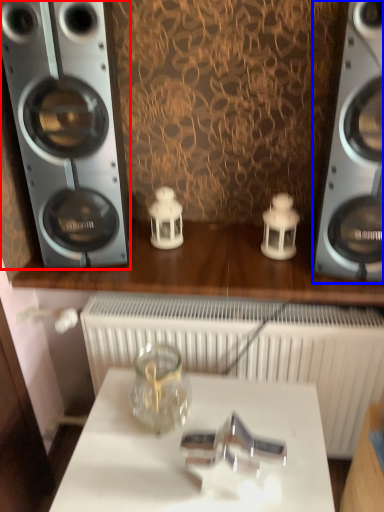
Question: Among these objects, which one is farthest to the camera, home appliance (highlighted by a red box) or home appliance (highlighted by a blue box)?

Choices:
 (A) home appliance
 (B) home appliance

Answer: (A)